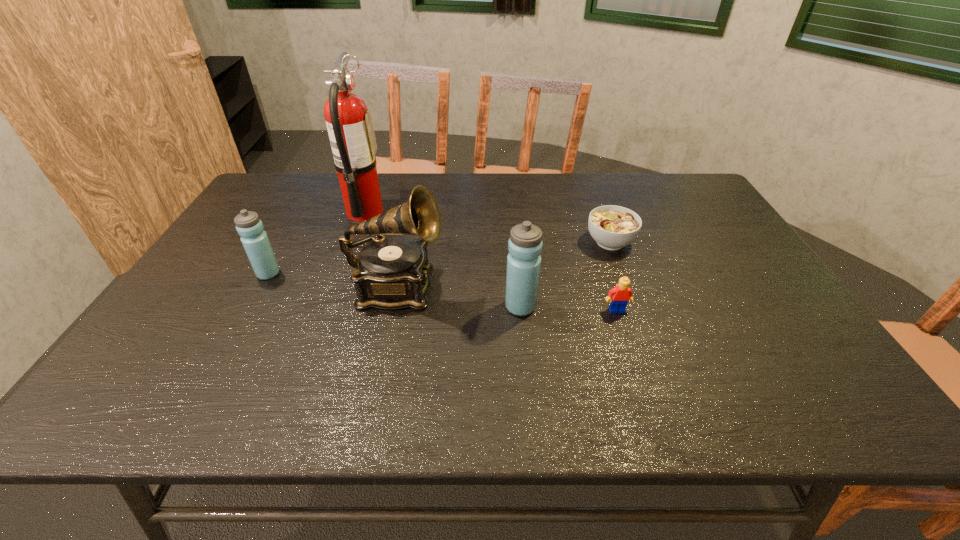
Where is `vacant space that is in between the tallest object and the fifth tallest object`? vacant space that is in between the tallest object and the fifth tallest object is located at coordinates (491, 261).

Locate an element on the screen. The image size is (960, 540). free space between the third shortest object and the tallest object is located at coordinates (317, 242).

Where is `free space between the leftmost object and the second tallest object`? This screenshot has width=960, height=540. free space between the leftmost object and the second tallest object is located at coordinates (333, 281).

Find the location of a particular element. vacant area that lies between the shorter water bottle and the second tallest object is located at coordinates (333, 281).

At what (x,y) coordinates should I click in order to perform the action: click on free space between the right water bottle and the Lego. Please return your answer as a coordinate pair (x, y). This screenshot has width=960, height=540. Looking at the image, I should click on (568, 308).

Find the location of a particular element. This screenshot has height=540, width=960. unoccupied position between the tallest object and the third shortest object is located at coordinates (317, 242).

The width and height of the screenshot is (960, 540). What are the coordinates of `blank region between the tallest object and the third tallest object` in the screenshot? It's located at (443, 259).

This screenshot has width=960, height=540. I want to click on vacant region between the tallest object and the third object from right to left, so click(x=443, y=259).

Image resolution: width=960 pixels, height=540 pixels. Find the location of `empty space that is in between the right water bottle and the fifth shortest object`. empty space that is in between the right water bottle and the fifth shortest object is located at coordinates (459, 298).

Locate which object ranks in proximity to the soup bowl. Please provide its 2D coordinates. Your answer should be formatted as a tuple, i.e. [(x, y)], where the tuple contains the x and y coordinates of a point satisfying the conditions above.

[(621, 294)]